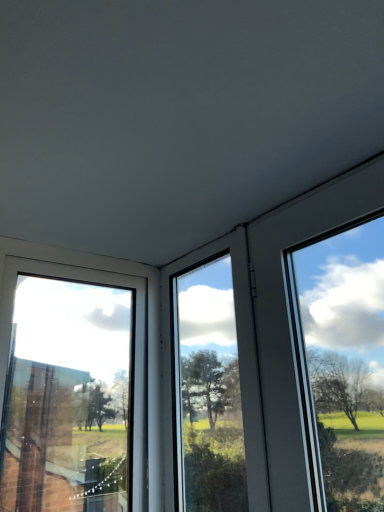
Question: Is transparent glass window at center, arranged as the 2th window when viewed from the left, completely or partially outside of transparent glass window at left, which ranks as the second window in right-to-left order?

Choices:
 (A) yes
 (B) no

Answer: (A)

Question: From the image's perspective, is transparent glass window at center, arranged as the 2th window when viewed from the left, above transparent glass window at left, marked as the first window in a left-to-right arrangement?

Choices:
 (A) no
 (B) yes

Answer: (B)

Question: Considering the relative sizes of transparent glass window at center, arranged as the 2th window when viewed from the left, and transparent glass window at left, which ranks as the second window in right-to-left order, in the image provided, is transparent glass window at center, arranged as the 2th window when viewed from the left, thinner than transparent glass window at left, which ranks as the second window in right-to-left order,?

Choices:
 (A) yes
 (B) no

Answer: (A)

Question: Does transparent glass window at center, placed as the first window when sorted from right to left, have a lesser height compared to transparent glass window at left, marked as the first window in a left-to-right arrangement?

Choices:
 (A) no
 (B) yes

Answer: (A)

Question: From the image's perspective, is transparent glass window at center, placed as the first window when sorted from right to left, beneath transparent glass window at left, which ranks as the second window in right-to-left order?

Choices:
 (A) yes
 (B) no

Answer: (B)

Question: Is transparent glass window at center, arranged as the 2th window when viewed from the left, touching transparent glass window at left, which ranks as the second window in right-to-left order?

Choices:
 (A) no
 (B) yes

Answer: (A)

Question: Considering the relative positions of transparent glass window at left, which ranks as the second window in right-to-left order, and transparent glass window at center, arranged as the 2th window when viewed from the left, in the image provided, is transparent glass window at left, which ranks as the second window in right-to-left order, to the left of transparent glass window at center, arranged as the 2th window when viewed from the left, from the viewer's perspective?

Choices:
 (A) yes
 (B) no

Answer: (A)

Question: Is transparent glass window at left, marked as the first window in a left-to-right arrangement, taller than transparent glass window at center, placed as the first window when sorted from right to left?

Choices:
 (A) no
 (B) yes

Answer: (A)

Question: Is transparent glass window at left, which ranks as the second window in right-to-left order, aimed at transparent glass window at center, arranged as the 2th window when viewed from the left?

Choices:
 (A) yes
 (B) no

Answer: (A)

Question: Considering the relative sizes of transparent glass window at left, marked as the first window in a left-to-right arrangement, and transparent glass window at center, placed as the first window when sorted from right to left, in the image provided, is transparent glass window at left, marked as the first window in a left-to-right arrangement, shorter than transparent glass window at center, placed as the first window when sorted from right to left,?

Choices:
 (A) no
 (B) yes

Answer: (B)

Question: Is transparent glass window at left, marked as the first window in a left-to-right arrangement, positioned before transparent glass window at center, placed as the first window when sorted from right to left?

Choices:
 (A) no
 (B) yes

Answer: (B)

Question: From the image's perspective, is transparent glass window at left, marked as the first window in a left-to-right arrangement, beneath transparent glass window at center, arranged as the 2th window when viewed from the left?

Choices:
 (A) yes
 (B) no

Answer: (A)

Question: From their relative heights in the image, would you say transparent glass window at left, marked as the first window in a left-to-right arrangement, is taller or shorter than transparent glass window at center, arranged as the 2th window when viewed from the left?

Choices:
 (A) tall
 (B) short

Answer: (B)